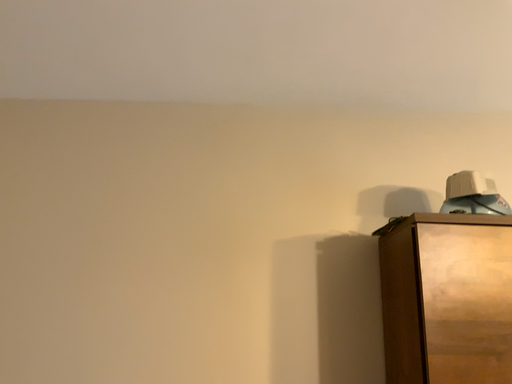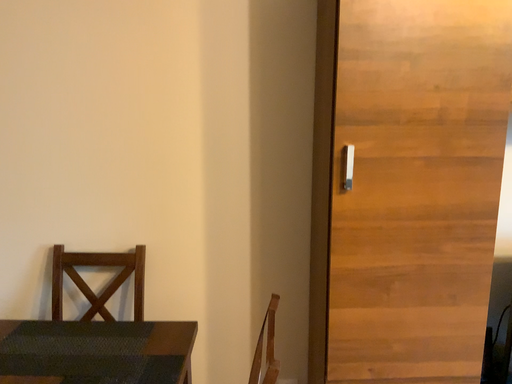
Question: Which way did the camera rotate in the video?

Choices:
 (A) rotated upward
 (B) rotated downward

Answer: (B)